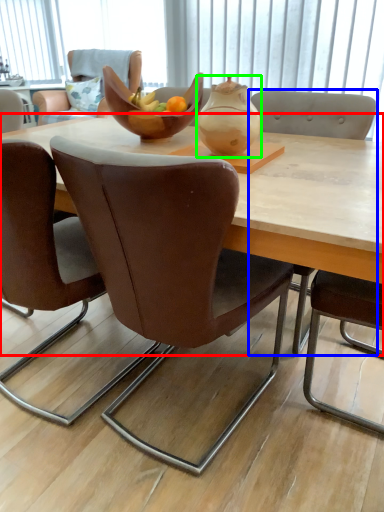
Question: Which object is the closest to the coffee table (highlighted by a red box)? Choose among these: chair (highlighted by a blue box) or tea pot (highlighted by a green box).

Choices:
 (A) chair
 (B) tea pot

Answer: (B)